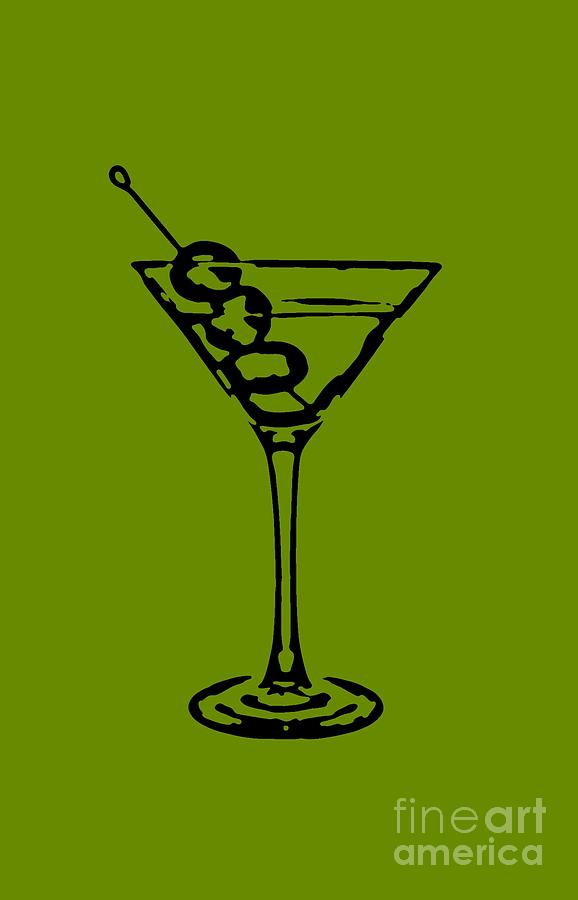
The width and height of the screenshot is (578, 900). In order to click on stem of glass in this screenshot , I will do `click(283, 479)`.